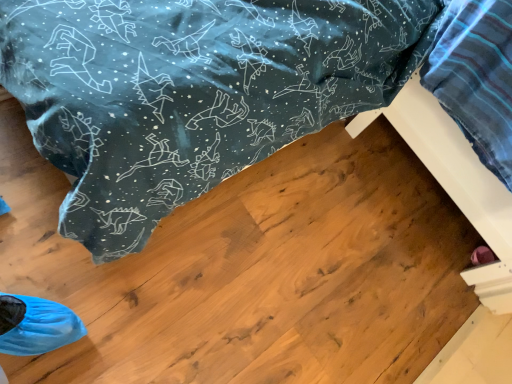
The width and height of the screenshot is (512, 384). What do you see at coordinates (466, 129) in the screenshot?
I see `white wood bed frame at lower right, the second furniture viewed from the left` at bounding box center [466, 129].

Measure the distance between point (507, 153) and camera.

The distance of point (507, 153) from camera is 37.32 inches.

Identify the location of white wood bed frame at lower right, the 1th furniture in the right-to-left sequence. The width and height of the screenshot is (512, 384). (466, 129).

Describe the element at coordinates (191, 92) in the screenshot. I see `wooden bed frame at lower right, which is the second furniture from right to left` at that location.

Locate an element on the screen. The image size is (512, 384). wooden bed frame at lower right, which is the second furniture from right to left is located at coordinates (191, 92).

Where is `white wood bed frame at lower right, the second furniture viewed from the left`? The height and width of the screenshot is (384, 512). white wood bed frame at lower right, the second furniture viewed from the left is located at coordinates (466, 129).

Can you confirm if wooden bed frame at lower right, placed as the first furniture when sorted from left to right, is positioned to the left of white wood bed frame at lower right, the second furniture viewed from the left?

Yes, wooden bed frame at lower right, placed as the first furniture when sorted from left to right, is to the left of white wood bed frame at lower right, the second furniture viewed from the left.

Is the position of wooden bed frame at lower right, which is the second furniture from right to left, more distant than that of white wood bed frame at lower right, the second furniture viewed from the left?

Yes, it is behind white wood bed frame at lower right, the second furniture viewed from the left.

Which is closer to the camera, (120, 115) or (474, 201)?

Clearly, point (120, 115) is closer to the camera than point (474, 201).

From the image's perspective, between wooden bed frame at lower right, which is the second furniture from right to left, and white wood bed frame at lower right, the 1th furniture in the right-to-left sequence, which one is located above?

white wood bed frame at lower right, the 1th furniture in the right-to-left sequence, from the image's perspective.

From a real-world perspective, which is physically below, wooden bed frame at lower right, placed as the first furniture when sorted from left to right, or white wood bed frame at lower right, the 1th furniture in the right-to-left sequence?

wooden bed frame at lower right, placed as the first furniture when sorted from left to right, is physically lower.

Does wooden bed frame at lower right, placed as the first furniture when sorted from left to right, have a greater width compared to white wood bed frame at lower right, the 1th furniture in the right-to-left sequence?

Indeed, wooden bed frame at lower right, placed as the first furniture when sorted from left to right, has a greater width compared to white wood bed frame at lower right, the 1th furniture in the right-to-left sequence.

Can you confirm if wooden bed frame at lower right, which is the second furniture from right to left, is shorter than white wood bed frame at lower right, the second furniture viewed from the left?

Yes.

Which of these two, wooden bed frame at lower right, which is the second furniture from right to left, or white wood bed frame at lower right, the 1th furniture in the right-to-left sequence, is bigger?

white wood bed frame at lower right, the 1th furniture in the right-to-left sequence, is bigger.

Would you say wooden bed frame at lower right, placed as the first furniture when sorted from left to right, contains white wood bed frame at lower right, the 1th furniture in the right-to-left sequence?

That's incorrect, white wood bed frame at lower right, the 1th furniture in the right-to-left sequence, is not inside wooden bed frame at lower right, placed as the first furniture when sorted from left to right.

Would you say wooden bed frame at lower right, which is the second furniture from right to left, is a long distance from white wood bed frame at lower right, the 1th furniture in the right-to-left sequence?

Actually, wooden bed frame at lower right, which is the second furniture from right to left, and white wood bed frame at lower right, the 1th furniture in the right-to-left sequence, are a little close together.

Is wooden bed frame at lower right, placed as the first furniture when sorted from left to right, positioned with its back to white wood bed frame at lower right, the second furniture viewed from the left?

No, wooden bed frame at lower right, placed as the first furniture when sorted from left to right, is not facing the opposite direction of white wood bed frame at lower right, the second furniture viewed from the left.

How many degrees apart are the facing directions of wooden bed frame at lower right, which is the second furniture from right to left, and white wood bed frame at lower right, the 1th furniture in the right-to-left sequence?

2.81 degrees separate the facing orientations of wooden bed frame at lower right, which is the second furniture from right to left, and white wood bed frame at lower right, the 1th furniture in the right-to-left sequence.

This screenshot has height=384, width=512. What are the coordinates of `furniture that appears above the wooden bed frame at lower right, placed as the first furniture when sorted from left to right (from the image's perspective)` in the screenshot? It's located at (x=466, y=129).

Considering the relative positions of white wood bed frame at lower right, the 1th furniture in the right-to-left sequence, and wooden bed frame at lower right, placed as the first furniture when sorted from left to right, in the image provided, is white wood bed frame at lower right, the 1th furniture in the right-to-left sequence, to the right of wooden bed frame at lower right, placed as the first furniture when sorted from left to right, from the viewer's perspective?

Yes, white wood bed frame at lower right, the 1th furniture in the right-to-left sequence, is to the right of wooden bed frame at lower right, placed as the first furniture when sorted from left to right.

Which object is closer to the camera taking this photo, white wood bed frame at lower right, the 1th furniture in the right-to-left sequence, or wooden bed frame at lower right, placed as the first furniture when sorted from left to right?

Positioned in front is white wood bed frame at lower right, the 1th furniture in the right-to-left sequence.

Is point (469, 37) closer to camera compared to point (194, 3)?

No.

From the picture: From the image's perspective, is white wood bed frame at lower right, the second furniture viewed from the left, located beneath wooden bed frame at lower right, which is the second furniture from right to left?

Actually, white wood bed frame at lower right, the second furniture viewed from the left, appears above wooden bed frame at lower right, which is the second furniture from right to left, in the image.

From a real-world perspective, between white wood bed frame at lower right, the second furniture viewed from the left, and wooden bed frame at lower right, which is the second furniture from right to left, who is vertically higher?

white wood bed frame at lower right, the second furniture viewed from the left.

In terms of width, does white wood bed frame at lower right, the 1th furniture in the right-to-left sequence, look wider or thinner when compared to wooden bed frame at lower right, placed as the first furniture when sorted from left to right?

Considering their sizes, white wood bed frame at lower right, the 1th furniture in the right-to-left sequence, looks slimmer than wooden bed frame at lower right, placed as the first furniture when sorted from left to right.

Which of these two, white wood bed frame at lower right, the second furniture viewed from the left, or wooden bed frame at lower right, which is the second furniture from right to left, stands taller?

white wood bed frame at lower right, the second furniture viewed from the left, is taller.

Can you confirm if white wood bed frame at lower right, the second furniture viewed from the left, is bigger than wooden bed frame at lower right, placed as the first furniture when sorted from left to right?

Yes.

Is white wood bed frame at lower right, the 1th furniture in the right-to-left sequence, located outside wooden bed frame at lower right, placed as the first furniture when sorted from left to right?

Yes, white wood bed frame at lower right, the 1th furniture in the right-to-left sequence, is located beyond the bounds of wooden bed frame at lower right, placed as the first furniture when sorted from left to right.

Looking at this image, is white wood bed frame at lower right, the second furniture viewed from the left, far away from wooden bed frame at lower right, which is the second furniture from right to left?

No.

Could you tell me if white wood bed frame at lower right, the 1th furniture in the right-to-left sequence, is turned towards wooden bed frame at lower right, which is the second furniture from right to left?

No.

How many degrees apart are the facing directions of white wood bed frame at lower right, the second furniture viewed from the left, and wooden bed frame at lower right, placed as the first furniture when sorted from left to right?

2.81 degrees separate the facing orientations of white wood bed frame at lower right, the second furniture viewed from the left, and wooden bed frame at lower right, placed as the first furniture when sorted from left to right.

Locate an element on the screen. Image resolution: width=512 pixels, height=384 pixels. furniture lying below the white wood bed frame at lower right, the second furniture viewed from the left (from the image's perspective) is located at coordinates (191, 92).

I want to click on furniture behind the white wood bed frame at lower right, the 1th furniture in the right-to-left sequence, so click(191, 92).

Image resolution: width=512 pixels, height=384 pixels. What are the coordinates of `furniture above the wooden bed frame at lower right, which is the second furniture from right to left (from the image's perspective)` in the screenshot? It's located at (466, 129).